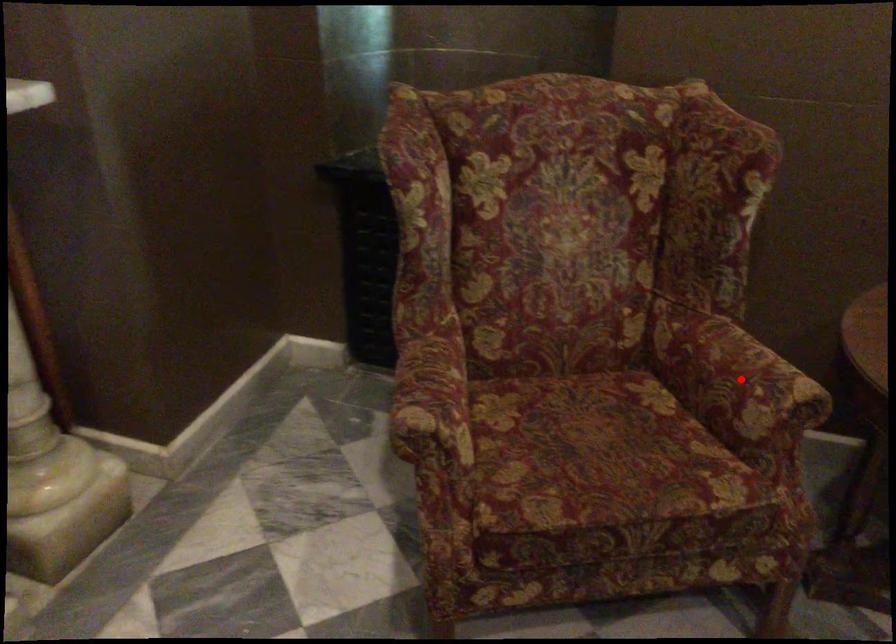
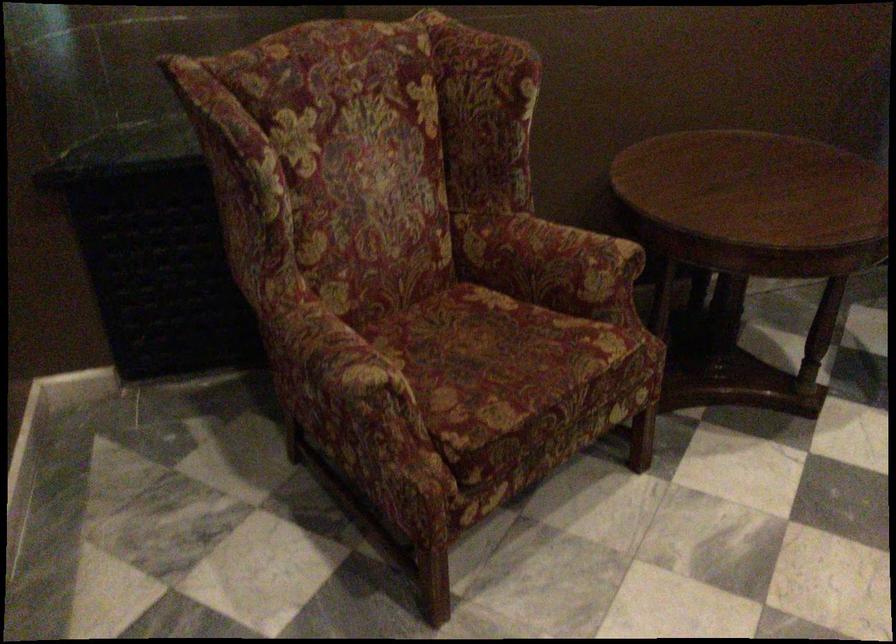
Question: I am providing you with two images of the same scene from different viewpoints. Image1 has a red point marked. In image2, the corresponding 3D location appears at what relative position? Reply with the corresponding letter.

Choices:
 (A) Closer
 (B) Farther

Answer: (B)